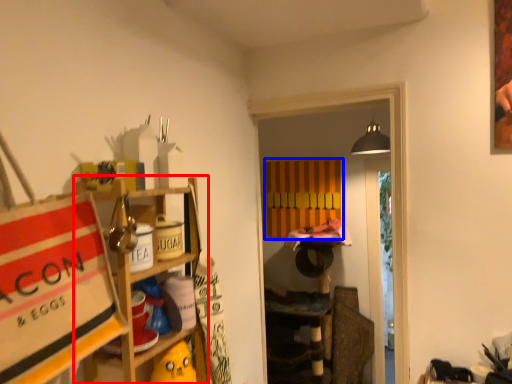
Question: Which object appears farthest to the camera in this image, shelf (highlighted by a red box) or cabinet (highlighted by a blue box)?

Choices:
 (A) shelf
 (B) cabinet

Answer: (B)